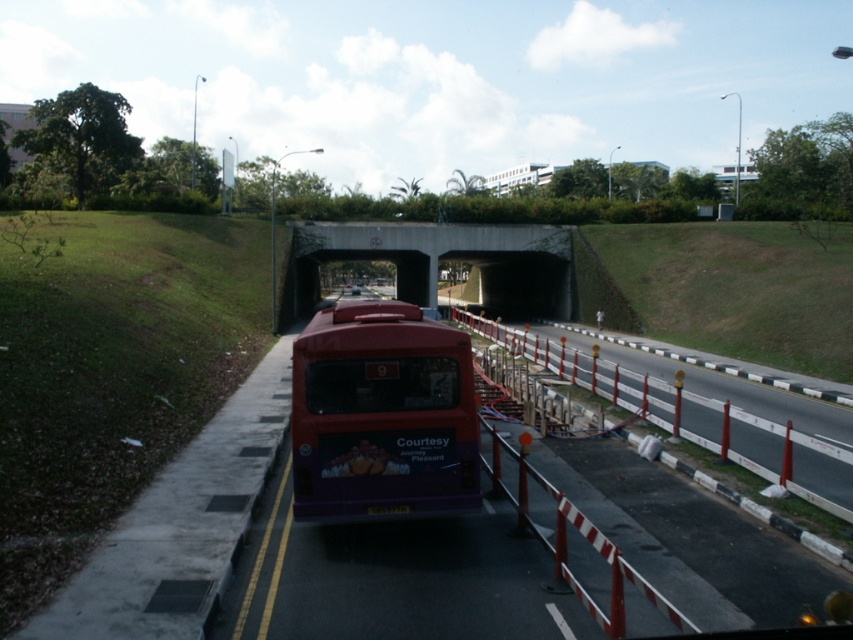
Question: Which object is closer to the camera taking this photo?

Choices:
 (A) concrete at center
 (B) metallic red barricade at center-right
 (C) matte purple bus at center

Answer: (B)

Question: Estimate the real-world distances between objects in this image. Which object is closer to the concrete at center?

Choices:
 (A) metallic red barricade at center-right
 (B) matte purple bus at center

Answer: (B)

Question: Can you confirm if matte purple bus at center is positioned to the right of metallic red barricade at center-right?

Choices:
 (A) yes
 (B) no

Answer: (B)

Question: Does matte purple bus at center appear on the left side of metallic red barricade at center-right?

Choices:
 (A) yes
 (B) no

Answer: (A)

Question: Which point appears farthest from the camera in this image?

Choices:
 (A) (498, 484)
 (B) (521, 266)
 (C) (378, 307)

Answer: (B)

Question: Does matte purple bus at center appear over concrete at center?

Choices:
 (A) no
 (B) yes

Answer: (A)